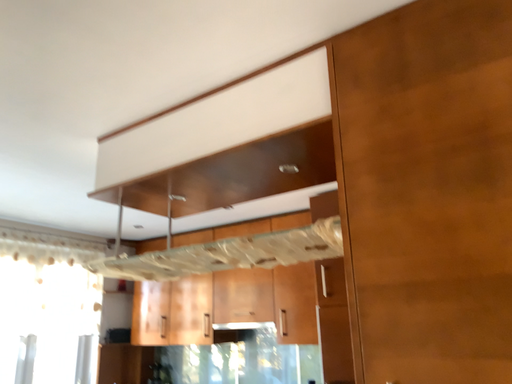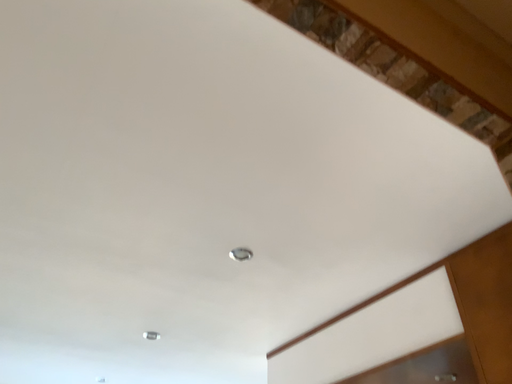
Question: How did the camera likely rotate when shooting the video?

Choices:
 (A) rotated downward
 (B) rotated upward

Answer: (B)